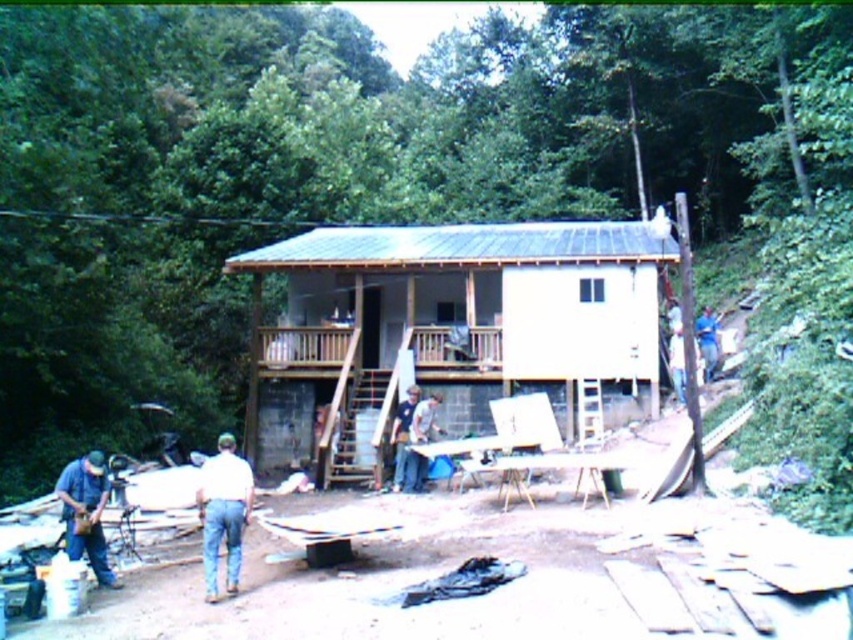
Question: Does white cotton shirt at lower center appear on the right side of denim shirt at lower left?

Choices:
 (A) yes
 (B) no

Answer: (A)

Question: Which object appears closest to the camera in this image?

Choices:
 (A) denim shirt at lower left
 (B) brown wooden porch at center
 (C) white cotton shirt at lower center

Answer: (C)

Question: Which of the following is the farthest from the observer?

Choices:
 (A) (347, 333)
 (B) (215, 550)
 (C) (73, 461)

Answer: (A)

Question: Can you confirm if brown wooden porch at center is thinner than white cotton shirt at lower center?

Choices:
 (A) yes
 (B) no

Answer: (B)

Question: Is brown wooden porch at center below denim shirt at lower left?

Choices:
 (A) no
 (B) yes

Answer: (A)

Question: Considering the real-world distances, which object is closest to the denim shirt at lower left?

Choices:
 (A) white cotton shirt at lower center
 (B) brown wooden porch at center

Answer: (A)